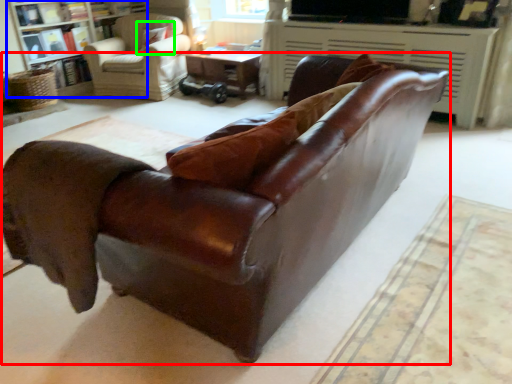
Question: Based on their relative distances, which object is nearer to studio couch (highlighted by a red box)? Choose from bookcase (highlighted by a blue box) and pillow (highlighted by a green box).

Choices:
 (A) bookcase
 (B) pillow

Answer: (B)